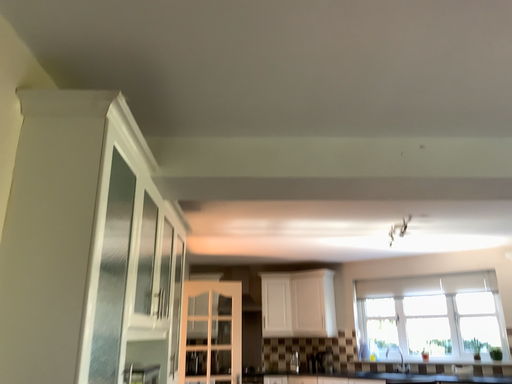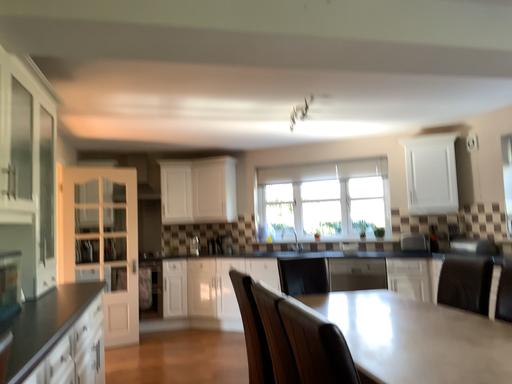
Question: How did the camera likely rotate when shooting the video?

Choices:
 (A) rotated right
 (B) rotated left

Answer: (A)